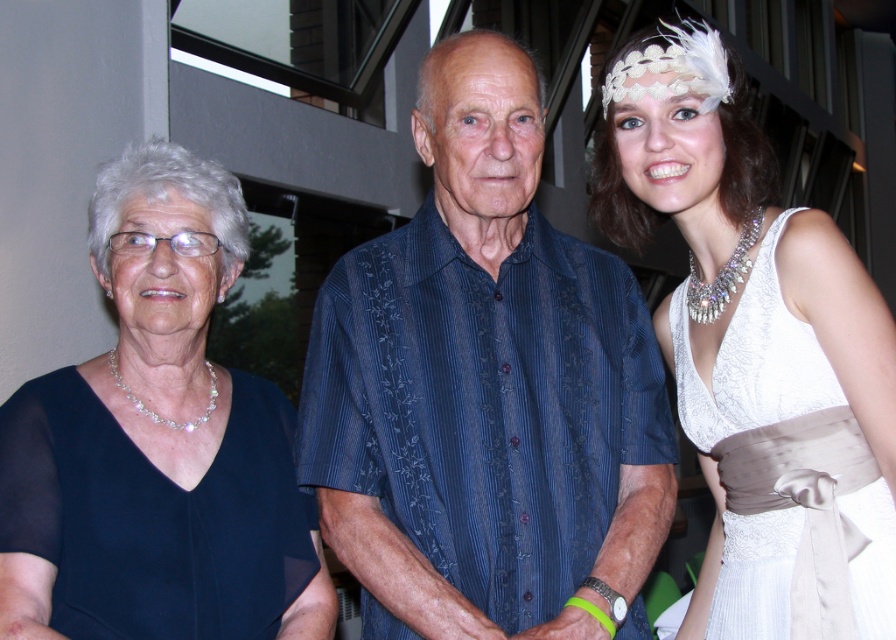
Question: Does matte black dress at left appear under white satin dress at right?

Choices:
 (A) no
 (B) yes

Answer: (A)

Question: In this image, where is matte black dress at left located relative to white satin dress at right?

Choices:
 (A) below
 (B) above

Answer: (B)

Question: Considering the real-world distances, which object is farthest from the matte black dress at left?

Choices:
 (A) blue striped shirt at center
 (B) white satin dress at right

Answer: (B)

Question: Where is matte black dress at left located in relation to white satin dress at right in the image?

Choices:
 (A) left
 (B) right

Answer: (A)

Question: Considering the real-world distances, which object is farthest from the matte black dress at left?

Choices:
 (A) white satin dress at right
 (B) blue striped shirt at center

Answer: (A)

Question: Which point appears closest to the camera in this image?

Choices:
 (A) (645, 547)
 (B) (737, 307)
 (C) (170, 435)

Answer: (C)